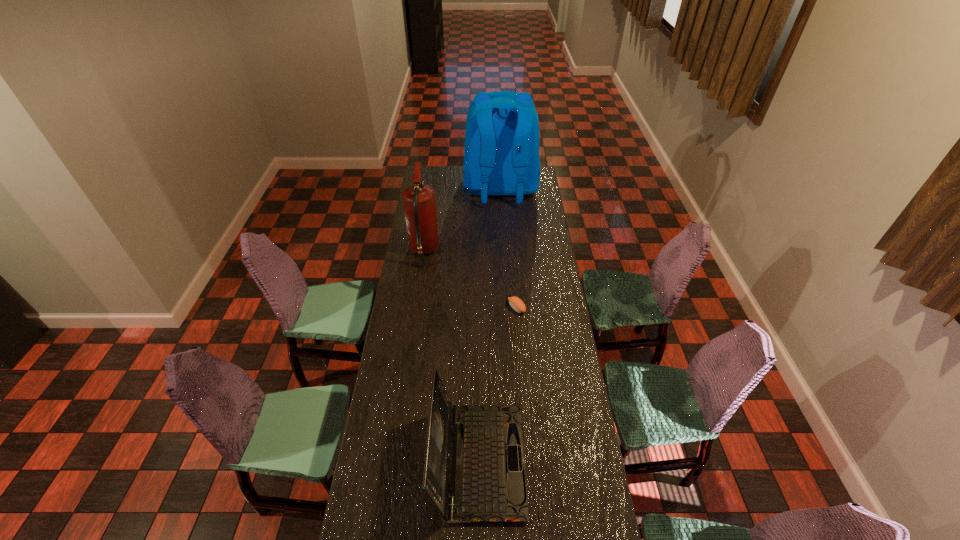
Identify the location of backpack. (501, 155).

Locate an element on the screen. the farthest object is located at coordinates [x=501, y=155].

This screenshot has width=960, height=540. Identify the location of the third shortest object. (419, 202).

Find the location of a particular element. The height and width of the screenshot is (540, 960). fire extinguisher is located at coordinates (419, 202).

Find the location of `the third tallest object`. the third tallest object is located at coordinates (487, 484).

The height and width of the screenshot is (540, 960). Find the location of `the nearest object`. the nearest object is located at coordinates (487, 484).

Locate an element on the screen. the shortest object is located at coordinates (516, 303).

Locate an element on the screen. The width and height of the screenshot is (960, 540). sushi is located at coordinates (516, 303).

Where is `vacant space located on the back of the backpack`? vacant space located on the back of the backpack is located at coordinates (503, 231).

This screenshot has width=960, height=540. Identify the location of blank space located at the front of the leftmost object where the nozzle is aimed. (452, 251).